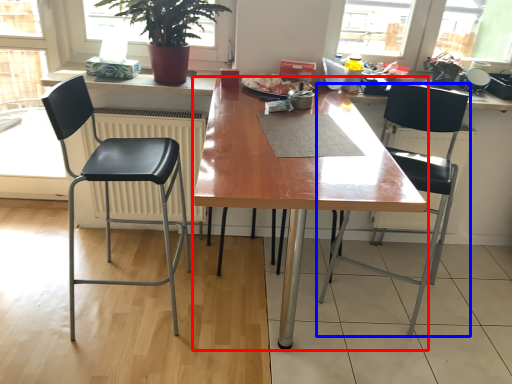
Question: Among these objects, which one is farthest to the camera, desk (highlighted by a red box) or chair (highlighted by a blue box)?

Choices:
 (A) desk
 (B) chair

Answer: (B)